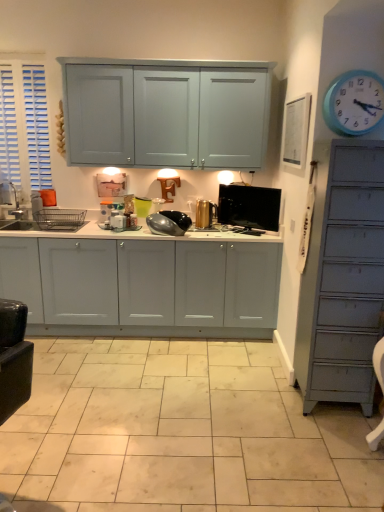
Question: From a real-world perspective, is black glossy tv at center, acting as the third appliance starting from the left, positioned above or below blue plastic clock at upper right?

Choices:
 (A) below
 (B) above

Answer: (A)

Question: Is black glossy tv at center, acting as the third appliance starting from the left, bigger or smaller than blue plastic clock at upper right?

Choices:
 (A) big
 (B) small

Answer: (A)

Question: Which object is the farthest from the blue plastic clock at upper right?

Choices:
 (A) white glossy tile at center
 (B) glossy black coffee pot at center, which is counted as the 1th appliance, starting from the left
 (C) gold metallic canister at center, which ranks as the 2th appliance in right-to-left order
 (D) black glossy tv at center, acting as the third appliance starting from the left
 (E) brushed metal sink at left

Answer: (E)

Question: Which is farther from the white glossy tile at center?

Choices:
 (A) white glossy cabinets at center
 (B) glossy black coffee pot at center, which is counted as the 1th appliance, starting from the left
 (C) black glossy tv at center, the 1th appliance viewed from the right
 (D) blue plastic clock at upper right
 (E) gold metallic canister at center, the 2th appliance in the left-to-right sequence

Answer: (D)